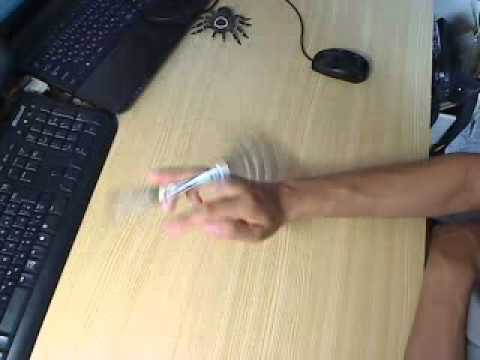
This screenshot has width=480, height=360. I want to click on pen, so click(201, 180).